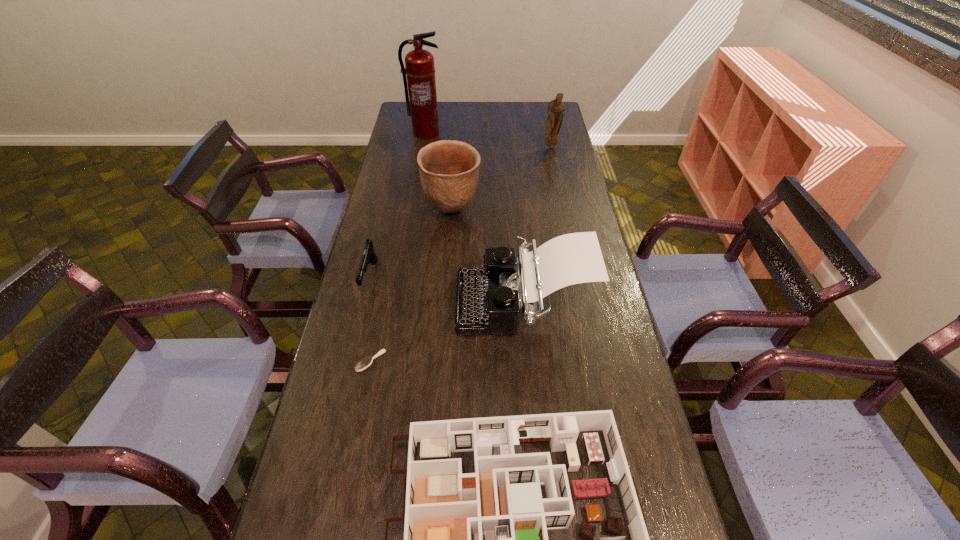
Where is `typewriter at the right edge`? The height and width of the screenshot is (540, 960). typewriter at the right edge is located at coordinates (488, 301).

Find the location of a particular element. free space at the far edge of the desktop is located at coordinates (464, 112).

The height and width of the screenshot is (540, 960). In order to click on vacant region at the left edge of the desktop in this screenshot , I will do `click(337, 338)`.

The width and height of the screenshot is (960, 540). In order to click on vacant area at the right edge in this screenshot , I will do `click(574, 211)`.

This screenshot has height=540, width=960. I want to click on vacant area that lies between the pottery and the gun, so click(411, 245).

This screenshot has height=540, width=960. In order to click on vacant space that is in between the gun and the scrubbing brush in this screenshot , I will do `click(371, 320)`.

Identify the location of free space between the gun and the farthest object. (397, 206).

Locate an element on the screen. The height and width of the screenshot is (540, 960). free spot between the figurine and the typewriter is located at coordinates (537, 225).

Find the location of a particular element. This screenshot has height=540, width=960. object that is the sixth closest to the farthest object is located at coordinates (480, 539).

Image resolution: width=960 pixels, height=540 pixels. Identify the location of object that is the third closest one to the typewriter. (480, 539).